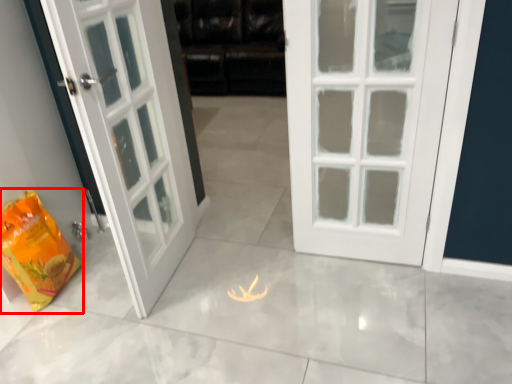
Question: From the image's perspective, what is the correct spatial relationship of shopping bag (annotated by the red box) in relation to dark?

Choices:
 (A) above
 (B) below

Answer: (B)